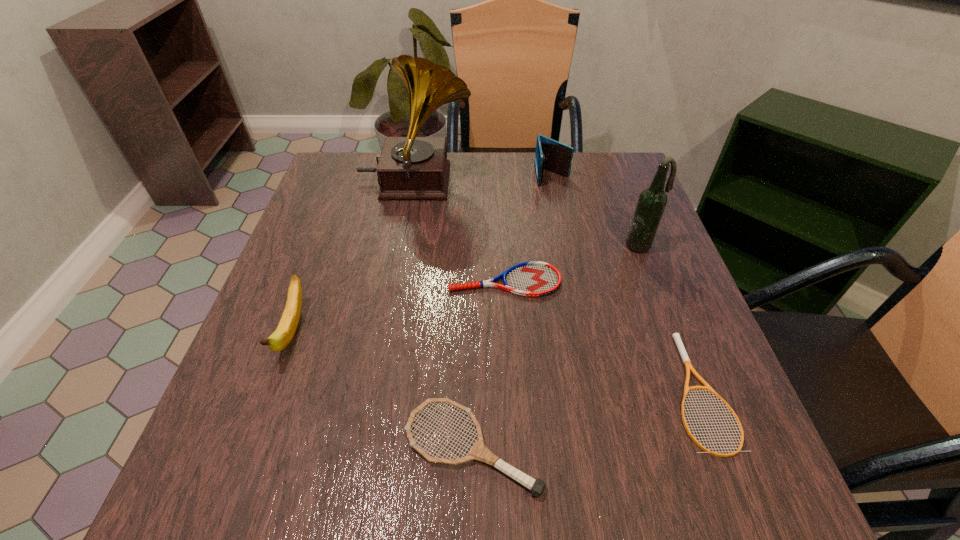
At what (x,y) coordinates should I click in order to perform the action: click on phonograph record. Please return your answer as a coordinate pair (x, y). Looking at the image, I should click on (411, 167).

Identify the location of the second tallest object. click(x=652, y=201).

Find the location of `the fifth nearest object`. the fifth nearest object is located at coordinates (652, 201).

The height and width of the screenshot is (540, 960). Identify the location of wallet. (551, 155).

Where is `the leftmost object`? Image resolution: width=960 pixels, height=540 pixels. the leftmost object is located at coordinates (283, 335).

Find the location of a particular element. the tallest tennis racket is located at coordinates (479, 451).

Find the location of `the farthest tennis racket`. the farthest tennis racket is located at coordinates (533, 278).

I want to click on the shortest tennis racket, so click(x=676, y=336).

Where is `the rightmost tennis racket`? The width and height of the screenshot is (960, 540). the rightmost tennis racket is located at coordinates (676, 336).

Identify the location of free spot located 0.210m from the horn of the tallest object. (554, 183).